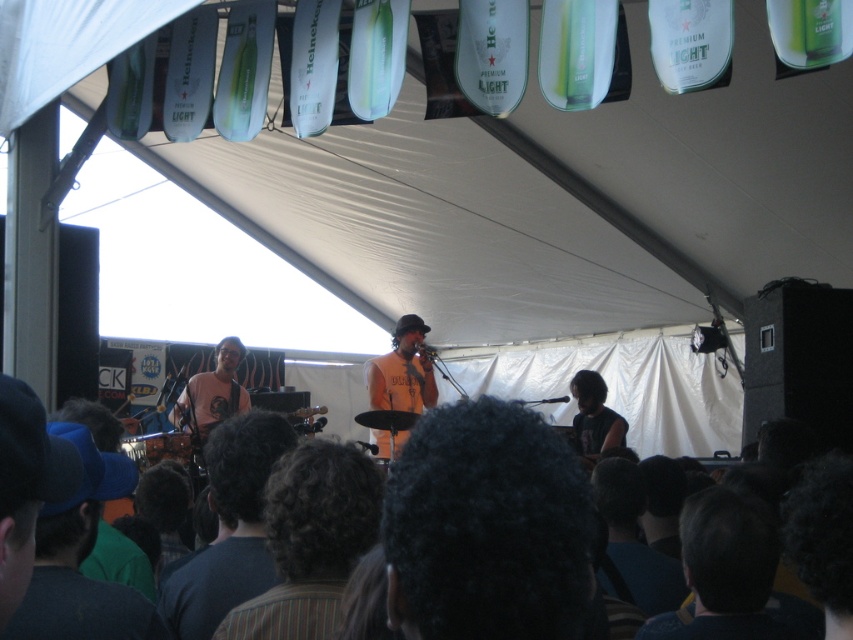
Question: Among these points, which one is nearest to the camera?

Choices:
 (A) (258, 458)
 (B) (395, 406)

Answer: (A)

Question: Is blue fabric cap at lower left further to the viewer compared to dark brown hair at lower center?

Choices:
 (A) no
 (B) yes

Answer: (A)

Question: Can you confirm if blue fabric cap at lower left is wider than dark brown hair at lower center?

Choices:
 (A) no
 (B) yes

Answer: (A)

Question: Does brown striped shirt at center have a larger size compared to blue fabric cap at lower left?

Choices:
 (A) no
 (B) yes

Answer: (A)

Question: Which object is positioned closest to the blue fabric cap at lower left?

Choices:
 (A) dark brown hair at lower center
 (B) orange cotton shirt at center
 (C) brown striped shirt at center

Answer: (A)

Question: Which point is farther to the camera?

Choices:
 (A) brown striped shirt at center
 (B) dark brown hair at lower center
 (C) blue fabric cap at lower left

Answer: (B)